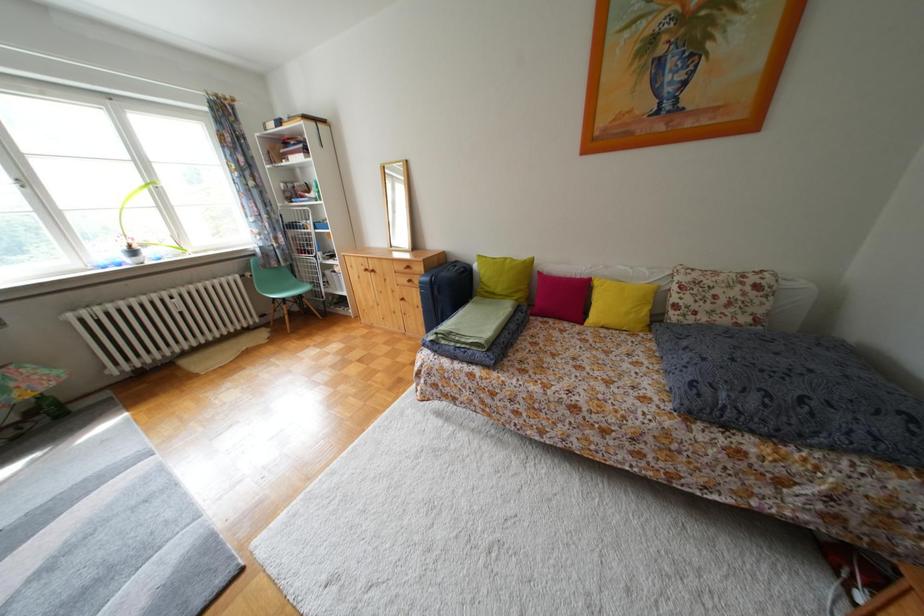
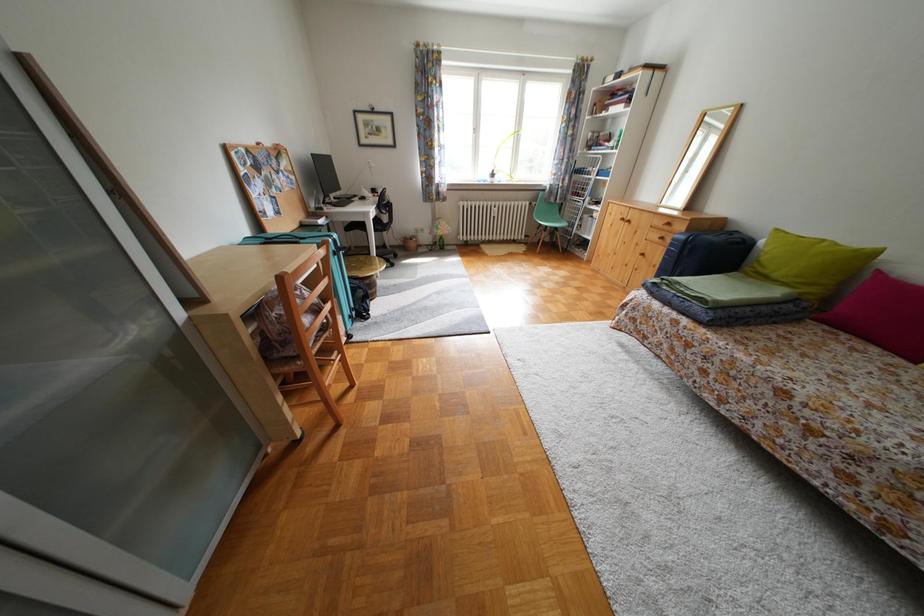
How did the camera likely rotate?

The camera rotated toward left-down.